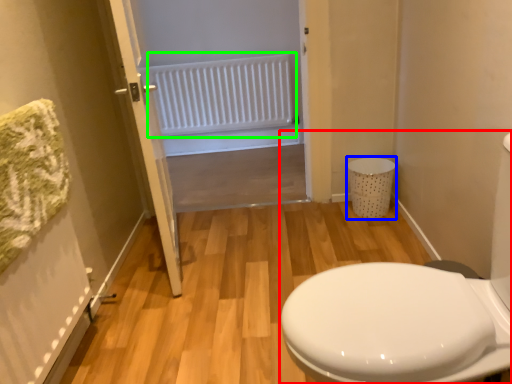
Question: Considering the real-world distances, which object is closest to porcelain (highlighted by a red box)? laundry basket (highlighted by a blue box) or radiator (highlighted by a green box).

Choices:
 (A) laundry basket
 (B) radiator

Answer: (A)